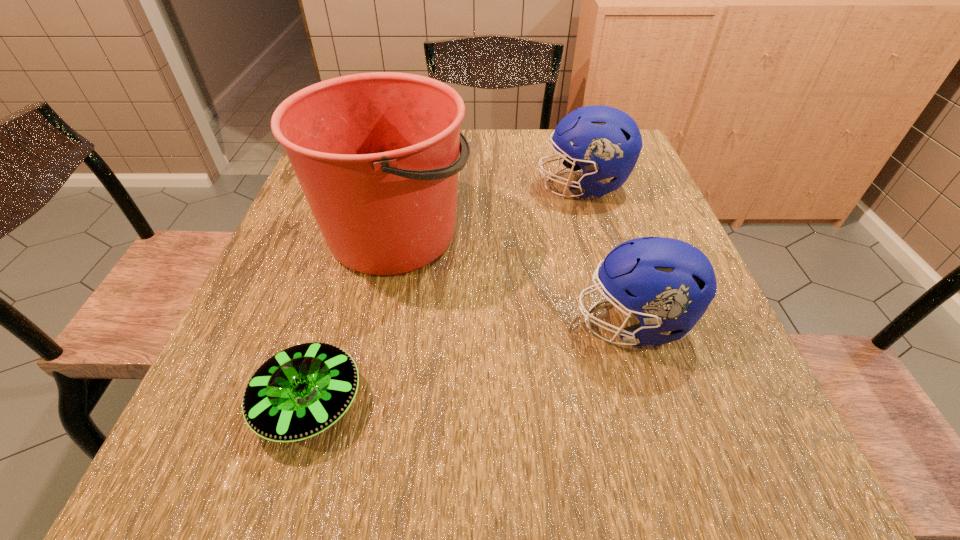
Locate an element on the screen. empty space that is in between the nearer football helmet and the saucer is located at coordinates (471, 362).

Locate an element on the screen. vacant area that lies between the bucket and the nearer football helmet is located at coordinates (514, 278).

This screenshot has width=960, height=540. Find the location of `object that ranks as the second closest to the nearer football helmet`. object that ranks as the second closest to the nearer football helmet is located at coordinates (607, 142).

Select which object is the closest to the nearer football helmet. Please provide its 2D coordinates. Your answer should be formatted as a tuple, i.e. [(x, y)], where the tuple contains the x and y coordinates of a point satisfying the conditions above.

[(376, 154)]